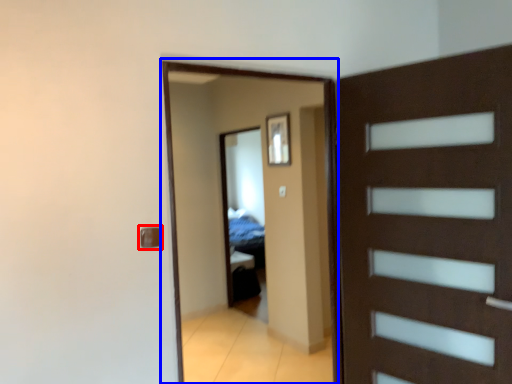
Question: Which object is closer to the camera taking this photo, door handle (highlighted by a red box) or screen door (highlighted by a blue box)?

Choices:
 (A) door handle
 (B) screen door

Answer: (A)